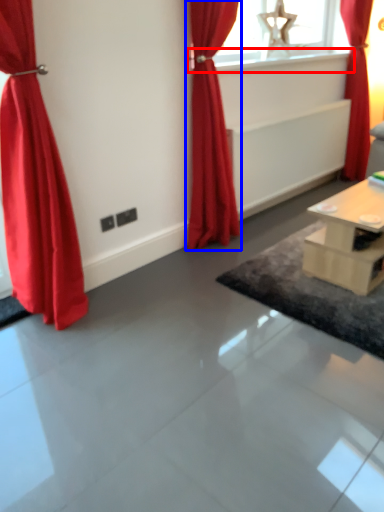
Question: Which of the following is the farthest to the observer, window sill (highlighted by a red box) or curtain (highlighted by a blue box)?

Choices:
 (A) window sill
 (B) curtain

Answer: (A)